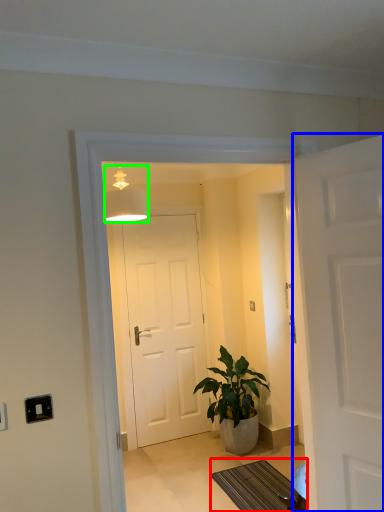
Question: Estimate the real-world distances between objects in this image. Which object is closer to doormat (highlighted by a red box), door (highlighted by a blue box) or lamp (highlighted by a green box)?

Choices:
 (A) door
 (B) lamp

Answer: (A)